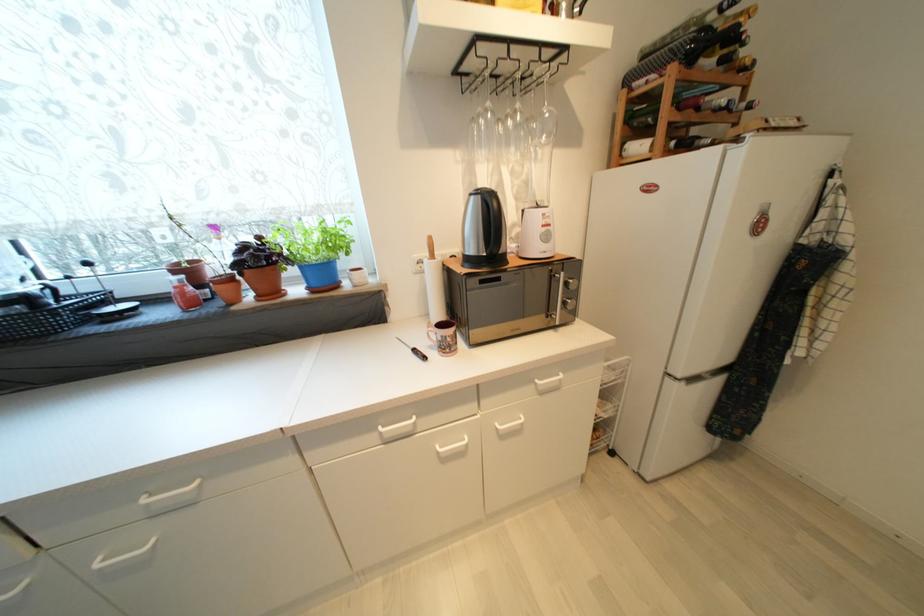
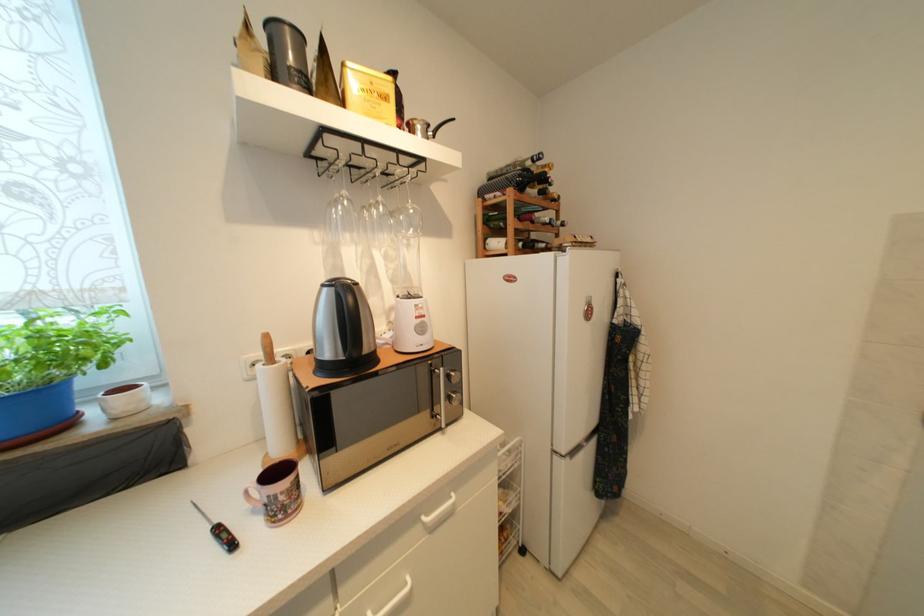
Find the pixel in the second image that matches [520,114] in the first image.

(383, 206)